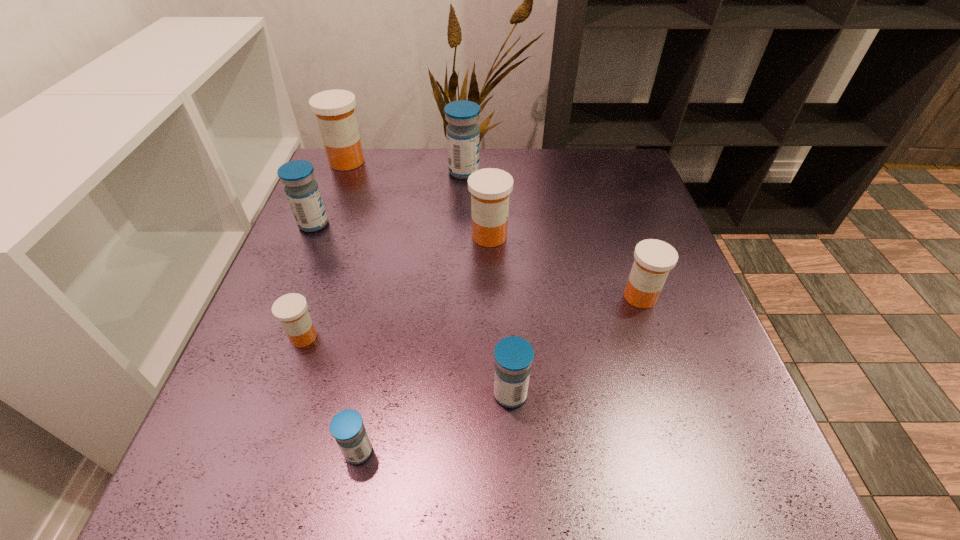
At what (x,y) coordinates should I click in order to perform the action: click on the biggest orange medicine. Please return your answer as a coordinate pair (x, y). The width and height of the screenshot is (960, 540). Looking at the image, I should click on (334, 109).

This screenshot has height=540, width=960. I want to click on the farthest blue medicine, so click(463, 143).

Locate an element on the screen. the biggest blue medicine is located at coordinates (463, 143).

Find the location of a particular element. The width and height of the screenshot is (960, 540). the third orange medicine from left to right is located at coordinates (490, 187).

I want to click on the third nearest orange medicine, so click(490, 187).

This screenshot has width=960, height=540. Identify the location of the leftmost blue medicine. (302, 191).

In order to click on the second farthest blue medicine in this screenshot , I will do `click(302, 191)`.

At what (x,y) coordinates should I click in order to perform the action: click on the fourth nearest medicine. Please return your answer as a coordinate pair (x, y). Image resolution: width=960 pixels, height=540 pixels. Looking at the image, I should click on (654, 259).

Image resolution: width=960 pixels, height=540 pixels. What are the coordinates of `the rightmost orange medicine` in the screenshot? It's located at (654, 259).

This screenshot has width=960, height=540. I want to click on the rightmost blue medicine, so click(513, 355).